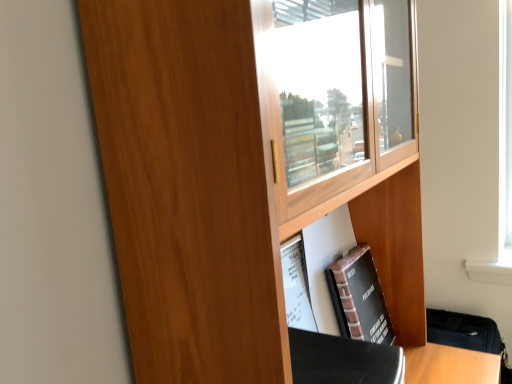
Question: From the image's perspective, relative to wooden cupboard at center, is black matte book at lower right above or below?

Choices:
 (A) above
 (B) below

Answer: (B)

Question: Considering the positions of black matte book at lower right and wooden cupboard at center in the image, is black matte book at lower right bigger or smaller than wooden cupboard at center?

Choices:
 (A) big
 (B) small

Answer: (B)

Question: Based on their positions, is black matte book at lower right located to the left or right of wooden cupboard at center?

Choices:
 (A) right
 (B) left

Answer: (A)

Question: Considering the positions of wooden cupboard at center and black matte book at lower right in the image, is wooden cupboard at center bigger or smaller than black matte book at lower right?

Choices:
 (A) big
 (B) small

Answer: (A)

Question: From a real-world perspective, relative to black matte book at lower right, is wooden cupboard at center vertically above or below?

Choices:
 (A) above
 (B) below

Answer: (A)

Question: From the image's perspective, is wooden cupboard at center positioned above or below black matte book at lower right?

Choices:
 (A) above
 (B) below

Answer: (A)

Question: Considering the relative positions of wooden cupboard at center and black matte book at lower right in the image provided, is wooden cupboard at center to the left or to the right of black matte book at lower right?

Choices:
 (A) right
 (B) left

Answer: (B)